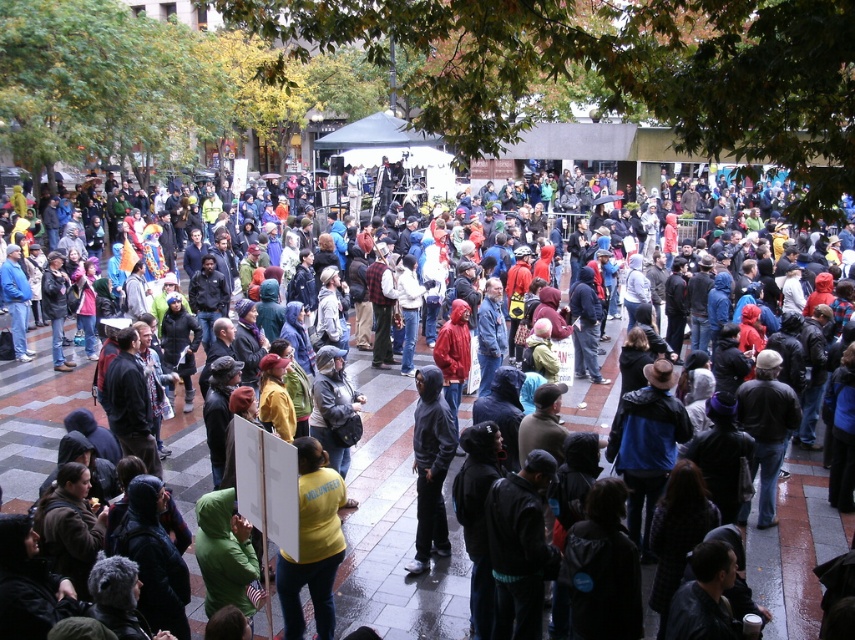
You are part of the crowd in the image and want to move from your current position to the right side of the dark gray hoodie at center. Which direction should you move relative to the yellow hoodie at center?

You should move to the right of the yellow hoodie at center since the yellow hoodie at center is to the left of the dark gray hoodie at center, meaning the dark gray hoodie at center is to the right of the yellow hoodie at center.

You are a photographer at the event and want to capture both the yellow hoodie at center and the yellow matte shirt at center in a single photo. Which one should you focus on first to ensure both are in frame?

The yellow hoodie at center is located above the yellow matte shirt at center, so focusing on the yellow hoodie at center first will help ensure both are within the frame.

You are a photographer trying to capture a photo of the crowd. You notice two hoodies at the center of the image, a yellow hoodie at center and a dark gray hoodie at center. Which one should you focus on to ensure it appears larger in your photo?

The yellow hoodie at center is much taller than the dark gray hoodie at center, so focusing on the yellow hoodie at center will make it appear larger in the photo.